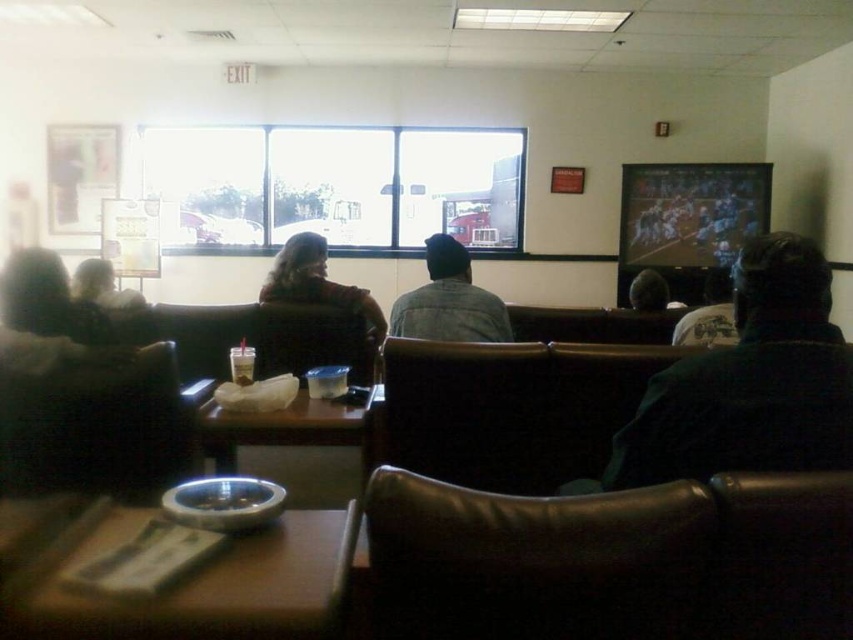
You are a person sitting in the lounge and want to borrow a coat from either the dark green sweater at right or the matte black jacket at left. Which one would you choose if you prefer a larger size?

The dark green sweater at right is bigger than the matte black jacket at left, so you should choose the dark green sweater at right.

You are a guest in this lounge and want to find the dark green sweater at right. Where would you look relative to the matte black jacket at left?

The dark green sweater at right is located below the matte black jacket at left, so you should look downward from the matte black jacket at left to find it.

You are a person who wants to place both the dark brown leather jacket at center and the dark gray knit cap at center into a storage box. The box can only hold items that are smaller than 1 meter in any dimension. Can both items fit?

The dark brown leather jacket at center has a larger size compared to dark gray knit cap at center. However, since the jacket is a typical garment, its maximum dimension when folded is likely under 1 meter. The knit cap is also smaller than 1 meter. Therefore, both items can fit into the storage box.